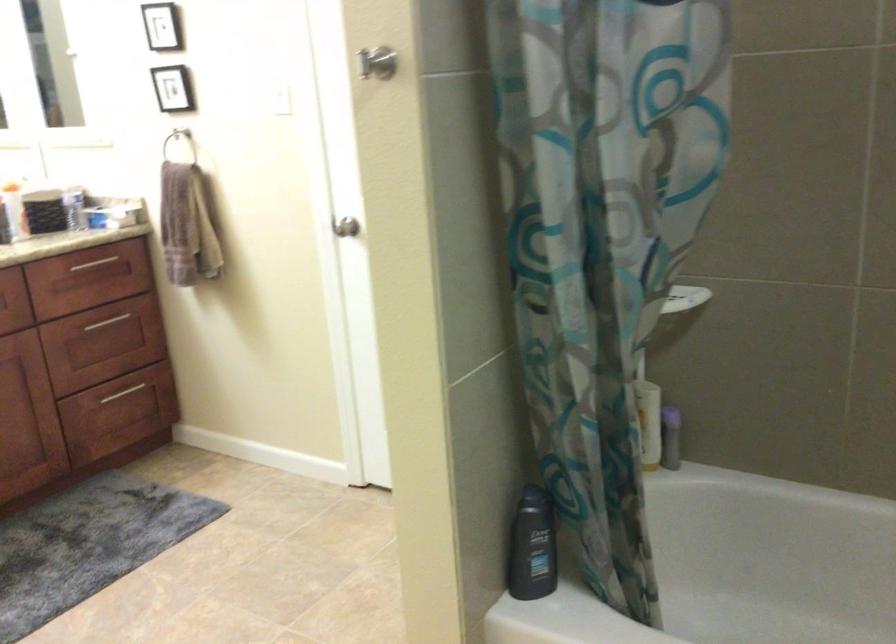
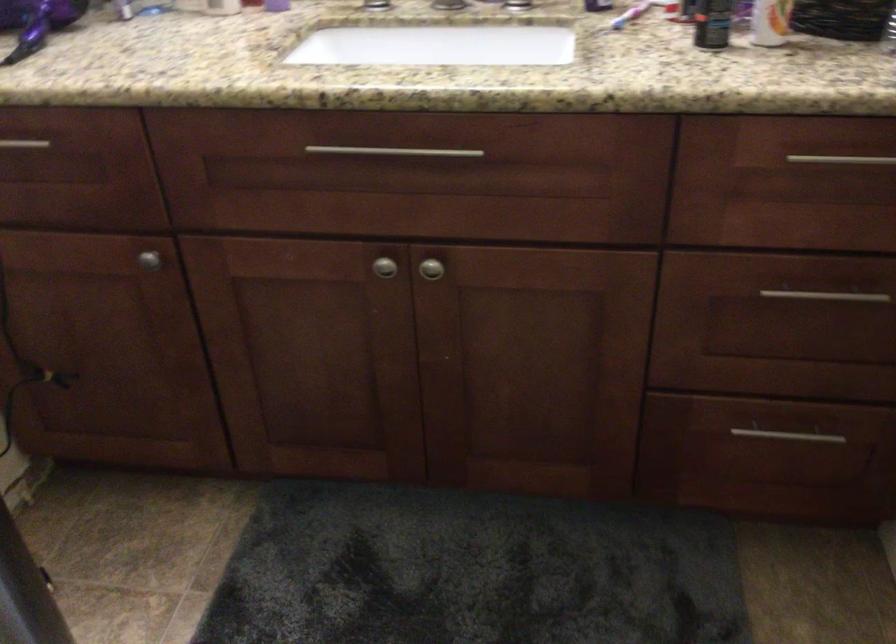
Question: I am providing you with two images of the same scene from different viewpoints. After the viewpoint changes to image2, which objects are now occluded?

Choices:
 (A) silver cabinet knob
 (B) orange and white bottle
 (C) black spray can
 (D) none of these

Answer: (D)